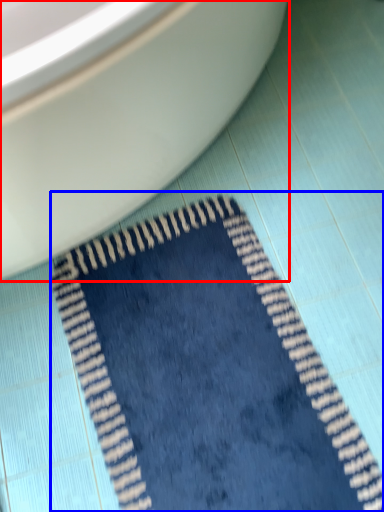
Question: Among these objects, which one is nearest to the camera, toilet (highlighted by a red box) or doormat (highlighted by a blue box)?

Choices:
 (A) toilet
 (B) doormat

Answer: (A)